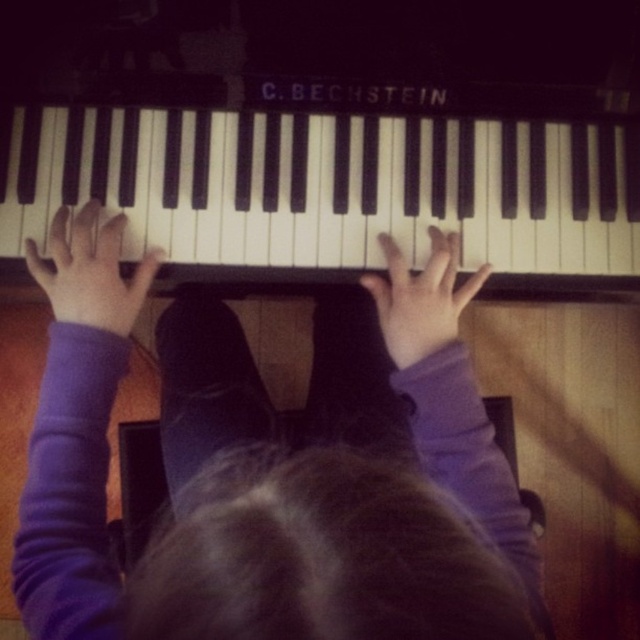
Question: Which of the following is the closest to the observer?

Choices:
 (A) (403, 348)
 (B) (124, 289)
 (C) (404, 333)

Answer: (A)

Question: Does purple fabric hands at center have a lesser width compared to purple matte hand at center?

Choices:
 (A) no
 (B) yes

Answer: (A)

Question: Among these points, which one is nearest to the camera?

Choices:
 (A) (58, 246)
 (B) (132, 588)
 (C) (413, 292)

Answer: (B)

Question: Is black polished piano at center closer to the viewer compared to purple matte hand at center?

Choices:
 (A) no
 (B) yes

Answer: (A)

Question: Which point is farther to the camera?

Choices:
 (A) purple matte hand at center
 (B) black polished piano at center
 (C) purple fabric hands at center
 (D) purple soft hand at center

Answer: (B)

Question: Is purple fabric hands at center closer to camera compared to purple matte hand at center?

Choices:
 (A) yes
 (B) no

Answer: (A)